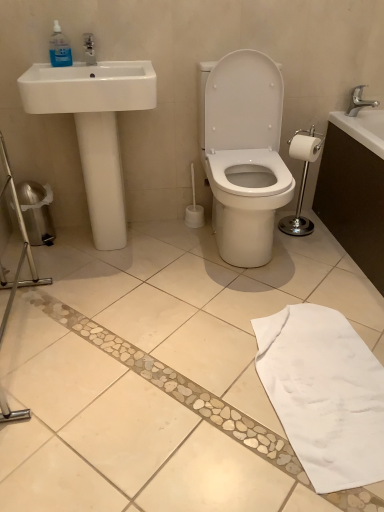
Find the location of a particular element. The image size is (384, 512). vacant space in front of silver metallic faucet at upper right is located at coordinates (362, 126).